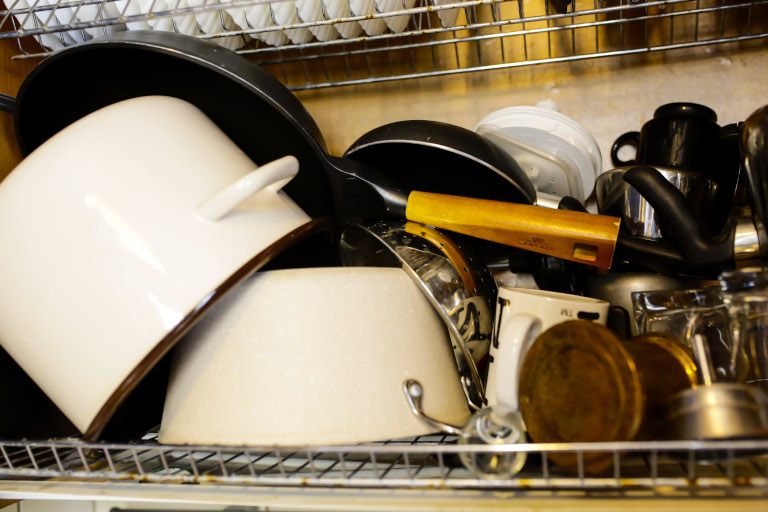
The width and height of the screenshot is (768, 512). I want to click on ceramic, so click(x=520, y=307).